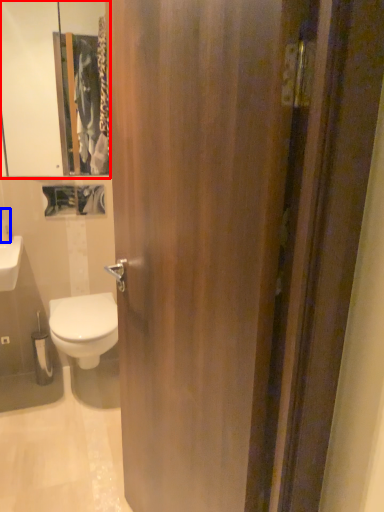
Question: Which of the following is the closest to the observer, medicine cabinet (highlighted by a red box) or toiletry (highlighted by a blue box)?

Choices:
 (A) medicine cabinet
 (B) toiletry

Answer: (A)